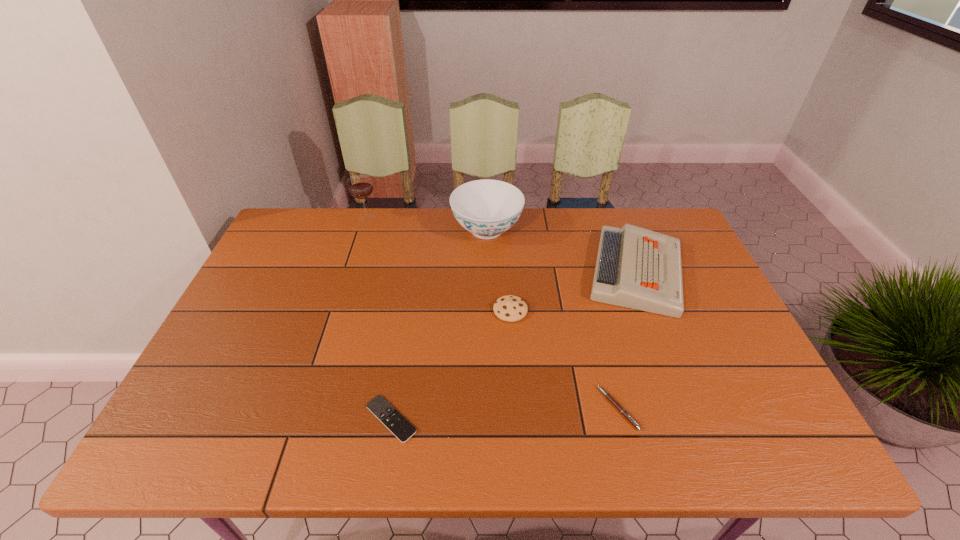
The image size is (960, 540). I want to click on wineglass, so click(360, 186).

Identify the location of the leftmost object. (360, 186).

Where is `the second tallest object`? The height and width of the screenshot is (540, 960). the second tallest object is located at coordinates (486, 208).

The height and width of the screenshot is (540, 960). What are the coordinates of `the third tallest object` in the screenshot? It's located at (637, 268).

You are a GUI agent. You are given a task and a screenshot of the screen. Output one action in this format:
    pyautogui.click(x=<x>, y=<y>)
    Task: Click on the cookie
    The width and height of the screenshot is (960, 540).
    Given the screenshot: What is the action you would take?
    pyautogui.click(x=510, y=308)

Where is `pen`? The image size is (960, 540). pen is located at coordinates (607, 395).

At what (x,y) coordinates should I click in order to perform the action: click on the shortest object. Please return your answer as a coordinate pair (x, y). Looking at the image, I should click on (380, 407).

The height and width of the screenshot is (540, 960). In order to click on remote control in this screenshot , I will do 380,407.

At what (x,y) coordinates should I click in order to perform the action: click on vacant space located 0.120m on the front of the tallest object. Please return your answer as a coordinate pair (x, y). The height and width of the screenshot is (540, 960). Looking at the image, I should click on (357, 247).

I want to click on vacant point located on the front of the chinaware, so click(x=489, y=319).